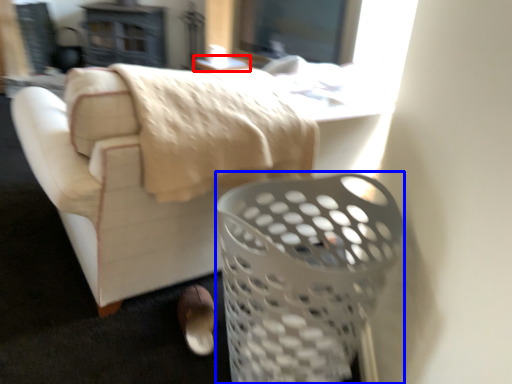
Question: Which of the following is the farthest to the observer, table (highlighted by a red box) or basket (highlighted by a blue box)?

Choices:
 (A) table
 (B) basket

Answer: (A)